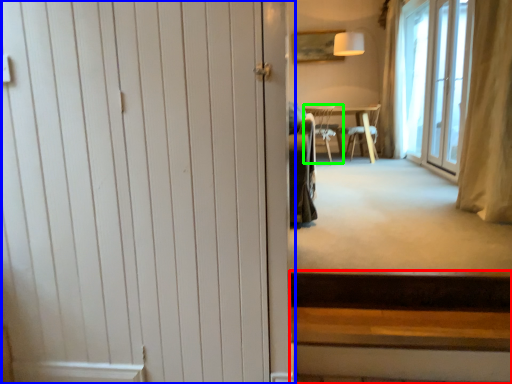
Question: Considering the real-world distances, which object is closest to stairs (highlighted by a red box)? door (highlighted by a blue box) or chair (highlighted by a green box).

Choices:
 (A) door
 (B) chair

Answer: (A)